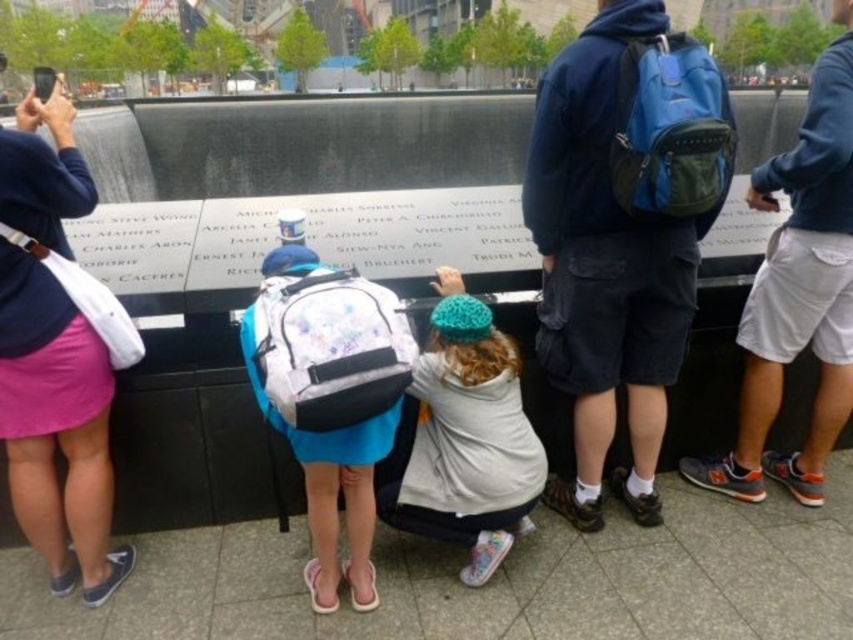
Question: Can you confirm if blue fabric backpack at center is positioned above gray cotton shorts at right?

Choices:
 (A) no
 (B) yes

Answer: (A)

Question: Considering the real-world distances, which object is farthest from the white knit hat at center?

Choices:
 (A) white fabric backpack at center
 (B) blue fabric backpack at center
 (C) pink fabric skirt at left
 (D) black plastic phone at upper left

Answer: (D)

Question: Among these objects, which one is nearest to the camera?

Choices:
 (A) blue fabric backpack at center
 (B) black plastic phone at upper left

Answer: (A)

Question: Which object appears closest to the camera in this image?

Choices:
 (A) black plastic phone at upper left
 (B) pink fabric skirt at left
 (C) white fabric backpack at center

Answer: (C)

Question: Does pink fabric skirt at left have a larger size compared to white knit hat at center?

Choices:
 (A) yes
 (B) no

Answer: (A)

Question: From the image, what is the correct spatial relationship of pink fabric skirt at left in relation to gray cotton shorts at right?

Choices:
 (A) left
 (B) right

Answer: (A)